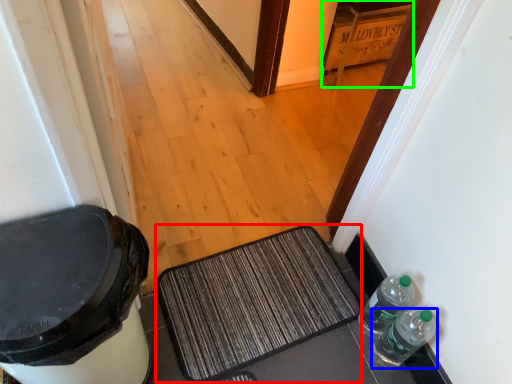
Question: Which is farther away from doormat (highlighted by a red box)? bottle (highlighted by a blue box) or cabinetry (highlighted by a green box)?

Choices:
 (A) bottle
 (B) cabinetry

Answer: (B)